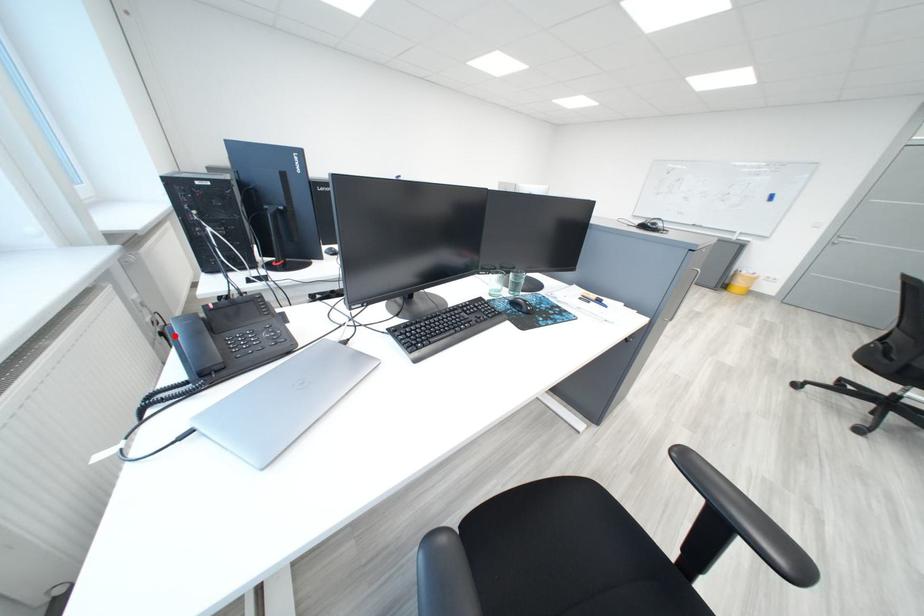
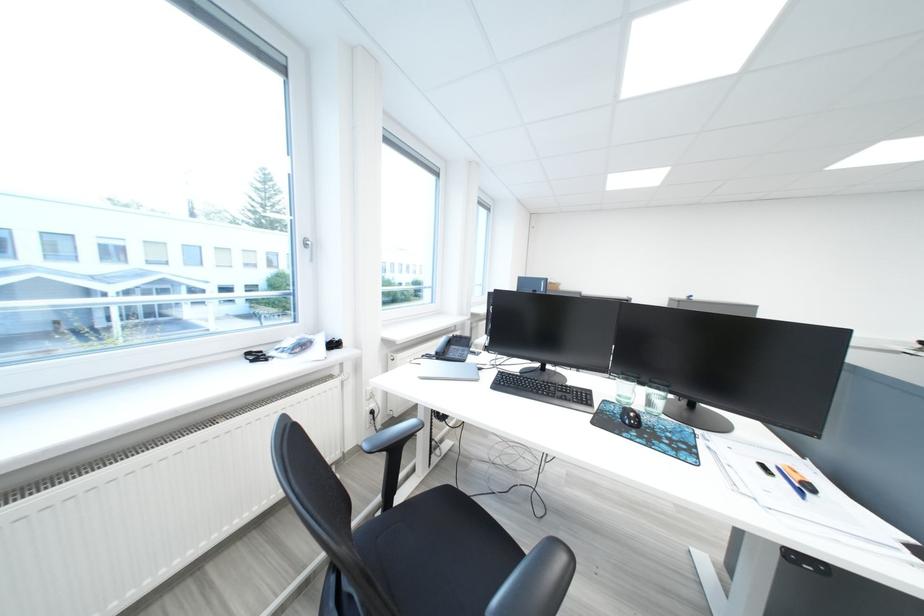
Question: I am providing you with two images of the same scene from different viewpoints. A red point is marked on the first image. Is the red point's position out of view in image 2?

Choices:
 (A) Yes
 (B) No

Answer: (A)